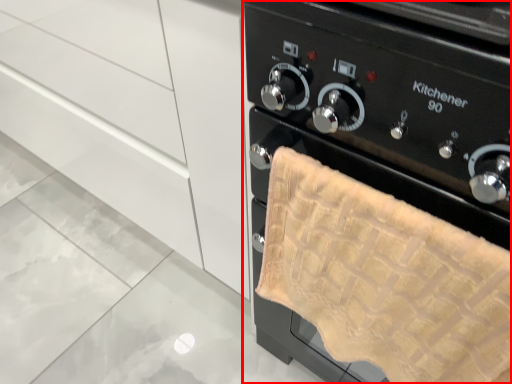
Question: Considering the relative positions of home appliance (annotated by the red box) and cabinetry in the image provided, where is home appliance (annotated by the red box) located with respect to the staircase?

Choices:
 (A) left
 (B) right

Answer: (B)